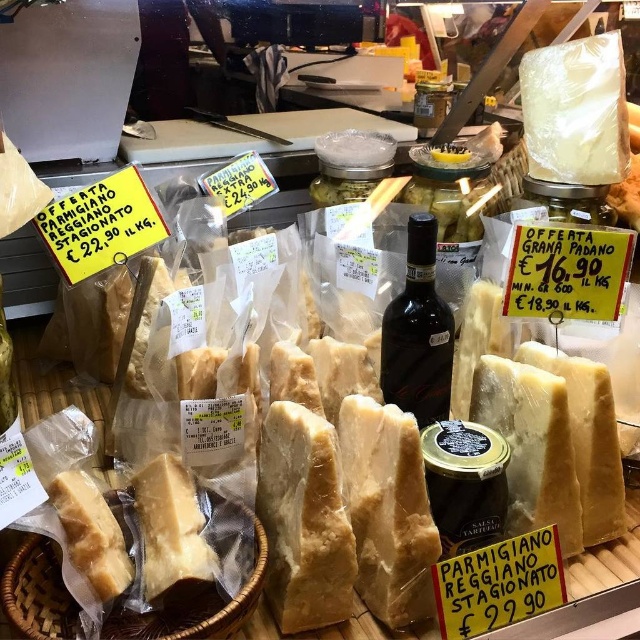
Question: Among these points, which one is nearest to the camera?

Choices:
 (A) (22, 625)
 (B) (381, 320)

Answer: (A)

Question: Can you confirm if translucent plastic bag at lower left is positioned above dark glass bottle at center?

Choices:
 (A) yes
 (B) no

Answer: (B)

Question: Can you confirm if translucent plastic bag at lower left is smaller than dark glass bottle at center?

Choices:
 (A) yes
 (B) no

Answer: (B)

Question: Among these objects, which one is farthest from the camera?

Choices:
 (A) translucent plastic bag at lower left
 (B) dark glass bottle at center

Answer: (B)

Question: Can you confirm if translucent plastic bag at lower left is thinner than dark glass bottle at center?

Choices:
 (A) no
 (B) yes

Answer: (A)